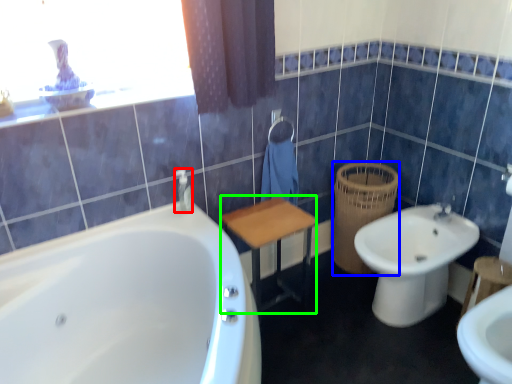
Question: Estimate the real-world distances between objects in this image. Which object is farther from toiletry (highlighted by a red box), basket (highlighted by a blue box) or vanity (highlighted by a green box)?

Choices:
 (A) basket
 (B) vanity

Answer: (A)